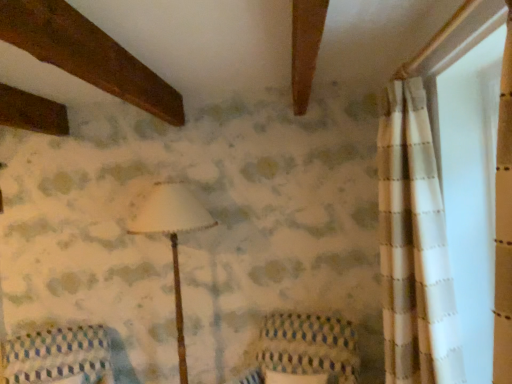
Question: From the image's perspective, would you say patterned fabric cushion at lower left is shown under white matte lampshade at center?

Choices:
 (A) no
 (B) yes

Answer: (B)

Question: Can you confirm if patterned fabric cushion at lower left is positioned to the left of white matte lampshade at center?

Choices:
 (A) yes
 (B) no

Answer: (A)

Question: From a real-world perspective, is patterned fabric cushion at lower left physically below white matte lampshade at center?

Choices:
 (A) no
 (B) yes

Answer: (B)

Question: Considering the relative sizes of patterned fabric cushion at lower left and white matte lampshade at center in the image provided, is patterned fabric cushion at lower left wider than white matte lampshade at center?

Choices:
 (A) no
 (B) yes

Answer: (B)

Question: Considering the relative sizes of patterned fabric cushion at lower left and white matte lampshade at center in the image provided, is patterned fabric cushion at lower left bigger than white matte lampshade at center?

Choices:
 (A) no
 (B) yes

Answer: (A)

Question: From the image's perspective, is white matte lampshade at center located above or below patterned fabric cushion at lower left?

Choices:
 (A) below
 (B) above

Answer: (B)

Question: Is point (169, 182) positioned closer to the camera than point (26, 349)?

Choices:
 (A) closer
 (B) farther

Answer: (B)

Question: Would you say white matte lampshade at center is to the left or to the right of patterned fabric cushion at lower left in the picture?

Choices:
 (A) right
 (B) left

Answer: (A)

Question: From a real-world perspective, relative to patterned fabric cushion at lower left, is white matte lampshade at center vertically above or below?

Choices:
 (A) above
 (B) below

Answer: (A)

Question: Considering the positions of patterned fabric cushion at lower left and knitted fabric armchair at center in the image, is patterned fabric cushion at lower left taller or shorter than knitted fabric armchair at center?

Choices:
 (A) short
 (B) tall

Answer: (A)

Question: From a real-world perspective, is patterned fabric cushion at lower left physically located above or below knitted fabric armchair at center?

Choices:
 (A) above
 (B) below

Answer: (A)

Question: In terms of width, does patterned fabric cushion at lower left look wider or thinner when compared to knitted fabric armchair at center?

Choices:
 (A) thin
 (B) wide

Answer: (B)

Question: In the image, is patterned fabric cushion at lower left on the left side or the right side of knitted fabric armchair at center?

Choices:
 (A) right
 (B) left

Answer: (B)

Question: From a real-world perspective, is knitted fabric armchair at center physically located above or below patterned fabric cushion at lower left?

Choices:
 (A) above
 (B) below

Answer: (B)

Question: From the image's perspective, relative to patterned fabric cushion at lower left, is knitted fabric armchair at center above or below?

Choices:
 (A) above
 (B) below

Answer: (A)